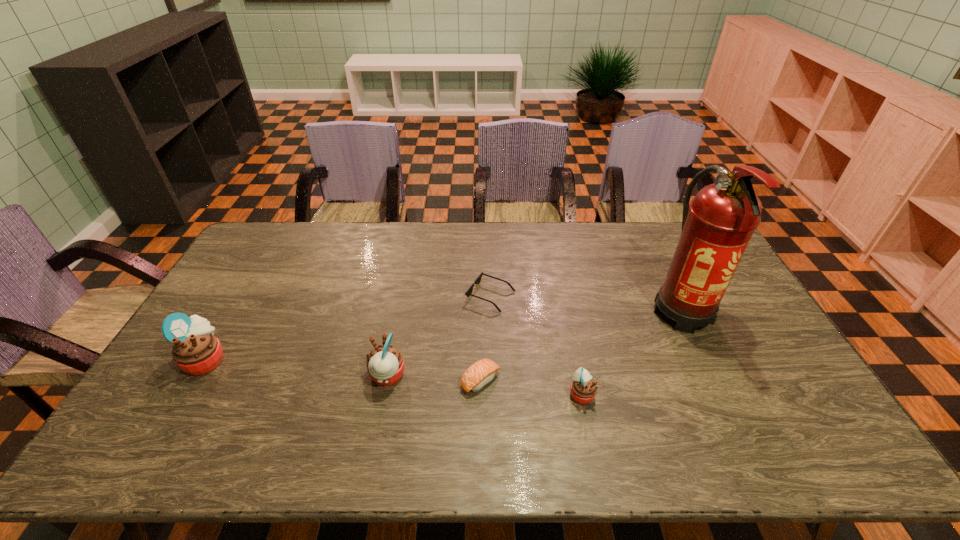
Find the location of a particular element. This screenshot has width=960, height=540. muffin that is the closest to the leftmost object is located at coordinates (385, 364).

Locate an element on the screen. The height and width of the screenshot is (540, 960). free space that satisfies the following two spatial constraints: 1. on the back side of the sushi; 2. on the front-facing side of the leftmost muffin is located at coordinates (481, 359).

Locate an element on the screen. The image size is (960, 540). blank space that satisfies the following two spatial constraints: 1. on the front-facing side of the rightmost object; 2. on the front-facing side of the leftmost muffin is located at coordinates (706, 359).

At what (x,y) coordinates should I click in order to perform the action: click on free space that satisfies the following two spatial constraints: 1. on the front-facing side of the leftmost object; 2. on the back side of the sushi. Please return your answer as a coordinate pair (x, y). The width and height of the screenshot is (960, 540). Looking at the image, I should click on (193, 381).

You are a GUI agent. You are given a task and a screenshot of the screen. Output one action in this format:
    pyautogui.click(x=<x>, y=<y>)
    Task: Click on the free region that satisfies the following two spatial constraints: 1. on the front-facing side of the rightmost object; 2. on the front-facing side of the leftmost object
    The width and height of the screenshot is (960, 540).
    Given the screenshot: What is the action you would take?
    pyautogui.click(x=706, y=359)

Where is `free spot that satisfies the following two spatial constraints: 1. on the front-facing side of the second shortest object; 2. on the left side of the leftmost muffin`? This screenshot has height=540, width=960. free spot that satisfies the following two spatial constraints: 1. on the front-facing side of the second shortest object; 2. on the left side of the leftmost muffin is located at coordinates (193, 381).

You are a GUI agent. You are given a task and a screenshot of the screen. Output one action in this format:
    pyautogui.click(x=<x>, y=<y>)
    Task: Click on the vacant space that satisfies the following two spatial constraints: 1. on the back side of the fifth tallest object; 2. on the front-facing side of the leftmost muffin
    The image size is (960, 540).
    Given the screenshot: What is the action you would take?
    pyautogui.click(x=481, y=359)